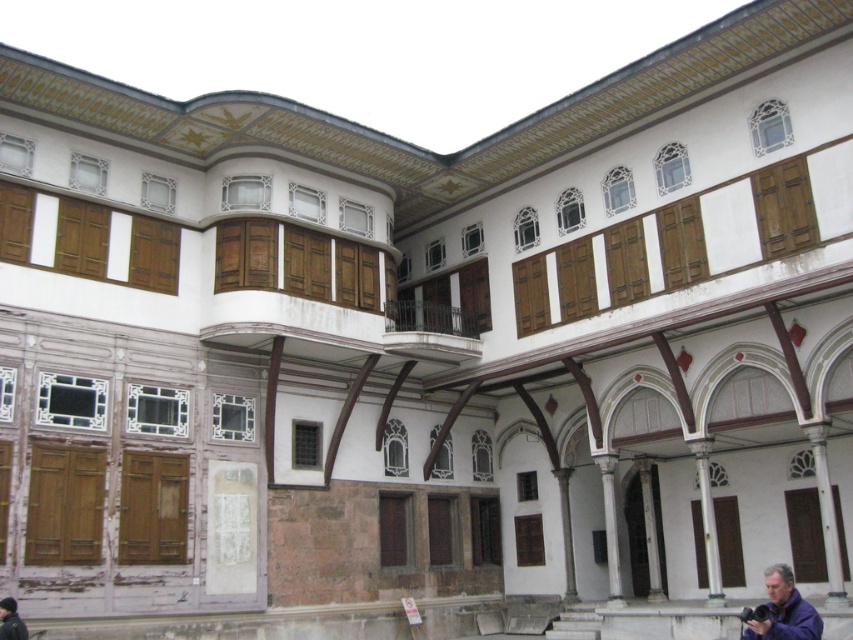
The height and width of the screenshot is (640, 853). What do you see at coordinates (784, 611) in the screenshot? I see `purple fabric at lower right` at bounding box center [784, 611].

Is purple fabric at lower right above dark blue fabric at lower left?

No, purple fabric at lower right is not above dark blue fabric at lower left.

At what (x,y) coordinates should I click in order to perform the action: click on purple fabric at lower right. Please return your answer as a coordinate pair (x, y). The image size is (853, 640). Looking at the image, I should click on click(784, 611).